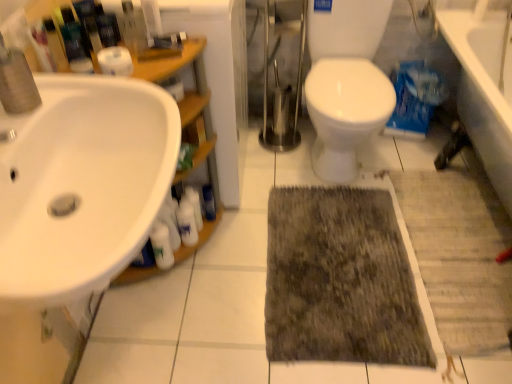
Image resolution: width=512 pixels, height=384 pixels. What are the coordinates of `vacant region in front of white glossy bottle at center, positioned as the 2th toiletry in left-to-right order` in the screenshot? It's located at (216, 259).